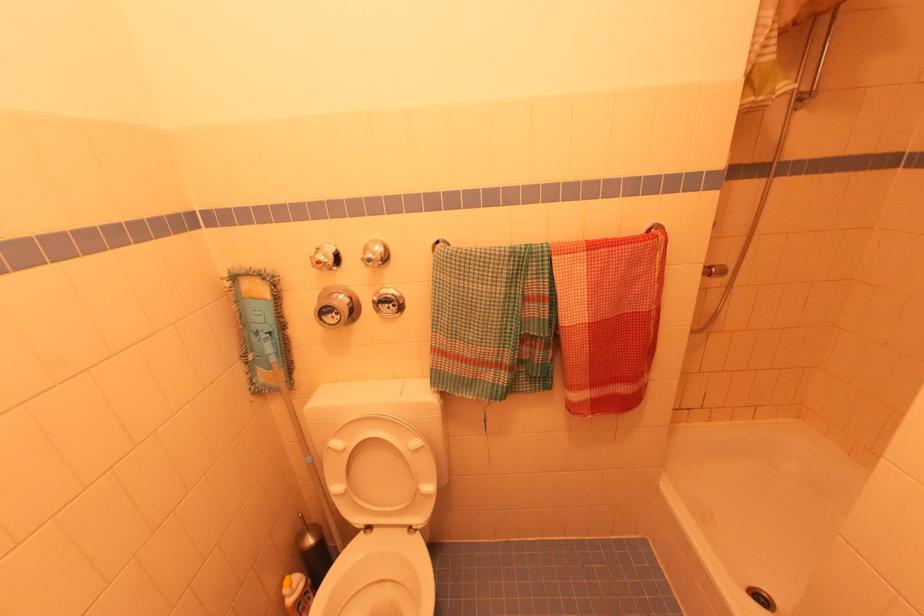
Where would you grasp the handheld shower head? Please return your answer as a coordinate pair (x, y).

(816, 60)